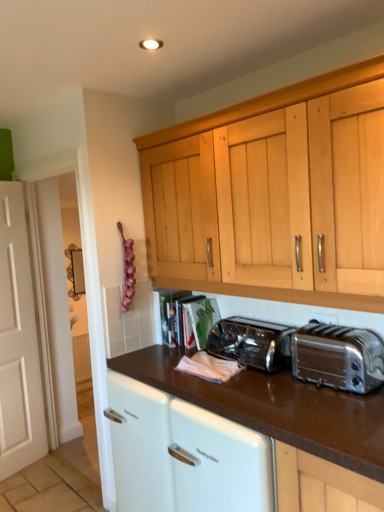
Locate an element on the screen. The width and height of the screenshot is (384, 512). brown glossy countertop at center is located at coordinates (276, 407).

Measure the distance between point (349, 372) and camera.

They are 1.64 meters apart.

The height and width of the screenshot is (512, 384). What do you see at coordinates (338, 357) in the screenshot?
I see `silver metallic toaster at right, the second toaster positioned from the back` at bounding box center [338, 357].

This screenshot has width=384, height=512. What are the coordinates of `brown glossy countertop at center` in the screenshot? It's located at (276, 407).

Is brown glossy countertop at center facing away from satin silver toaster at center, marked as the second toaster in a front-to-back arrangement?

brown glossy countertop at center does not have its back to satin silver toaster at center, marked as the second toaster in a front-to-back arrangement.

Starting from the brown glossy countertop at center, which toaster is the 1st one to the right? Please provide its 2D coordinates.

[(252, 343)]

Would you say satin silver toaster at center, which is the 1th toaster from back to front, is part of brown glossy countertop at center's contents?

No, satin silver toaster at center, which is the 1th toaster from back to front, is not surrounded by brown glossy countertop at center.

Could you tell me if satin silver toaster at center, marked as the second toaster in a front-to-back arrangement, is turned towards brown glossy countertop at center?

No, satin silver toaster at center, marked as the second toaster in a front-to-back arrangement, is not facing towards brown glossy countertop at center.

I want to click on toaster that is the 1st one when counting upward from the brown glossy countertop at center (from the image's perspective), so click(252, 343).

Based on the photo, considering the sizes of objects satin silver toaster at center, which is the 1th toaster from back to front, and brown glossy countertop at center in the image provided, who is thinner, satin silver toaster at center, which is the 1th toaster from back to front, or brown glossy countertop at center?

satin silver toaster at center, which is the 1th toaster from back to front.

From a real-world perspective, which is physically below, silver metallic toaster at right, the second toaster positioned from the back, or satin silver toaster at center, marked as the second toaster in a front-to-back arrangement?

In real-world perspective, satin silver toaster at center, marked as the second toaster in a front-to-back arrangement, is lower.

Considering the sizes of objects silver metallic toaster at right, which is the first toaster in front-to-back order, and satin silver toaster at center, which is the 1th toaster from back to front, in the image provided, who is bigger, silver metallic toaster at right, which is the first toaster in front-to-back order, or satin silver toaster at center, which is the 1th toaster from back to front,?

silver metallic toaster at right, which is the first toaster in front-to-back order, is bigger.

Would you say silver metallic toaster at right, the second toaster positioned from the back, is inside or outside satin silver toaster at center, which is the 1th toaster from back to front?

silver metallic toaster at right, the second toaster positioned from the back, is outside satin silver toaster at center, which is the 1th toaster from back to front.

Can you see silver metallic toaster at right, which is the first toaster in front-to-back order, touching satin silver toaster at center, marked as the second toaster in a front-to-back arrangement?

They are not placed beside each other.

Does point (346, 366) come behind point (340, 405)?

Yes, point (346, 366) is farther from viewer.

How many degrees apart are the facing directions of silver metallic toaster at right, which is the first toaster in front-to-back order, and brown glossy countertop at center?

silver metallic toaster at right, which is the first toaster in front-to-back order, and brown glossy countertop at center are facing 0.292 degrees away from each other.

Is silver metallic toaster at right, which is the first toaster in front-to-back order, to the right of brown glossy countertop at center from the viewer's perspective?

Indeed, silver metallic toaster at right, which is the first toaster in front-to-back order, is positioned on the right side of brown glossy countertop at center.

Does silver metallic toaster at right, which is the first toaster in front-to-back order, have a lesser height compared to brown glossy countertop at center?

Indeed, silver metallic toaster at right, which is the first toaster in front-to-back order, has a lesser height compared to brown glossy countertop at center.

From the image's perspective, is satin silver toaster at center, marked as the second toaster in a front-to-back arrangement, beneath silver metallic toaster at right, which is the first toaster in front-to-back order?

Indeed, from the image's perspective, satin silver toaster at center, marked as the second toaster in a front-to-back arrangement, is shown beneath silver metallic toaster at right, which is the first toaster in front-to-back order.

The width and height of the screenshot is (384, 512). I want to click on toaster above the satin silver toaster at center, marked as the second toaster in a front-to-back arrangement (from a real-world perspective), so click(338, 357).

Which is more to the right, satin silver toaster at center, marked as the second toaster in a front-to-back arrangement, or silver metallic toaster at right, which is the first toaster in front-to-back order?

From the viewer's perspective, silver metallic toaster at right, which is the first toaster in front-to-back order, appears more on the right side.

Does satin silver toaster at center, which is the 1th toaster from back to front, lie in front of silver metallic toaster at right, the second toaster positioned from the back?

No, satin silver toaster at center, which is the 1th toaster from back to front, is further to the viewer.

Where is `countertop located in front of the silver metallic toaster at right, which is the first toaster in front-to-back order`? This screenshot has width=384, height=512. countertop located in front of the silver metallic toaster at right, which is the first toaster in front-to-back order is located at coordinates click(x=276, y=407).

From their relative heights in the image, would you say brown glossy countertop at center is taller or shorter than silver metallic toaster at right, the second toaster positioned from the back?

Considering their sizes, brown glossy countertop at center has more height than silver metallic toaster at right, the second toaster positioned from the back.

Visually, is brown glossy countertop at center positioned to the left or to the right of silver metallic toaster at right, which is the first toaster in front-to-back order?

brown glossy countertop at center is to the left of silver metallic toaster at right, which is the first toaster in front-to-back order.

From a real-world perspective, which is physically above, brown glossy countertop at center or silver metallic toaster at right, the second toaster positioned from the back?

silver metallic toaster at right, the second toaster positioned from the back.

I want to click on countertop below the satin silver toaster at center, which is the 1th toaster from back to front (from a real-world perspective), so click(276, 407).

Where is `toaster that is the 1st one when counting upward from the brown glossy countertop at center (from the image's perspective)`? The height and width of the screenshot is (512, 384). toaster that is the 1st one when counting upward from the brown glossy countertop at center (from the image's perspective) is located at coordinates (252, 343).

Which object lies further to the anchor point brown glossy countertop at center, satin silver toaster at center, which is the 1th toaster from back to front, or silver metallic toaster at right, which is the first toaster in front-to-back order?

satin silver toaster at center, which is the 1th toaster from back to front, is positioned further to the anchor brown glossy countertop at center.

Considering their positions, is brown glossy countertop at center positioned further to silver metallic toaster at right, the second toaster positioned from the back, than satin silver toaster at center, which is the 1th toaster from back to front?

The object further to silver metallic toaster at right, the second toaster positioned from the back, is satin silver toaster at center, which is the 1th toaster from back to front.

From the image, which object appears to be farther from satin silver toaster at center, marked as the second toaster in a front-to-back arrangement, silver metallic toaster at right, the second toaster positioned from the back, or brown glossy countertop at center?

The object further to satin silver toaster at center, marked as the second toaster in a front-to-back arrangement, is silver metallic toaster at right, the second toaster positioned from the back.

When comparing their distances from silver metallic toaster at right, the second toaster positioned from the back, does satin silver toaster at center, which is the 1th toaster from back to front, or brown glossy countertop at center seem closer?

brown glossy countertop at center.

Looking at the image, which one is located closer to brown glossy countertop at center, silver metallic toaster at right, the second toaster positioned from the back, or satin silver toaster at center, marked as the second toaster in a front-to-back arrangement?

silver metallic toaster at right, the second toaster positioned from the back, lies closer to brown glossy countertop at center than the other object.

From the image, which object appears to be farther from satin silver toaster at center, marked as the second toaster in a front-to-back arrangement, brown glossy countertop at center or silver metallic toaster at right, the second toaster positioned from the back?

Based on the image, silver metallic toaster at right, the second toaster positioned from the back, appears to be further to satin silver toaster at center, marked as the second toaster in a front-to-back arrangement.

I want to click on toaster positioned between brown glossy countertop at center and satin silver toaster at center, which is the 1th toaster from back to front, from near to far, so click(338, 357).